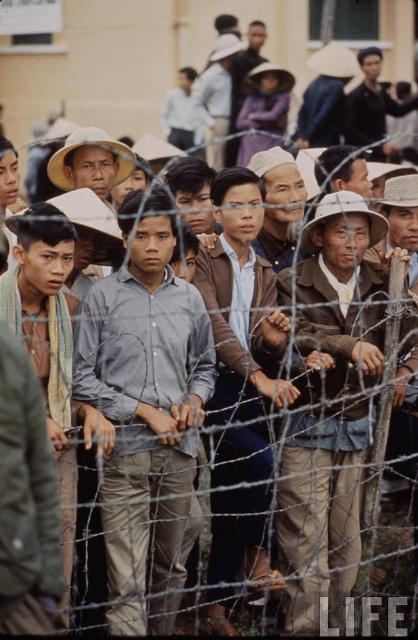
Does light brown fabric shirt at center have a larger size compared to dark green jacket at center?

Correct, light brown fabric shirt at center is larger in size than dark green jacket at center.

Is light brown fabric shirt at center positioned behind dark green jacket at center?

That is True.

This screenshot has height=640, width=418. What are the coordinates of `light brown fabric shirt at center` in the screenshot? It's located at (331, 408).

Can you confirm if light blue shirt at center is shorter than light brown fabric shirt at center?

Yes, light blue shirt at center is shorter than light brown fabric shirt at center.

Between point (145, 552) and point (349, 545), which one is positioned in front?

Point (145, 552)

Image resolution: width=418 pixels, height=640 pixels. Find the location of `light blue shirt at center`. light blue shirt at center is located at coordinates (145, 410).

Can you confirm if light blue shirt at center is smaller than brown leather jacket at center?

Correct, light blue shirt at center occupies less space than brown leather jacket at center.

Find the location of a particular element. The height and width of the screenshot is (640, 418). light blue shirt at center is located at coordinates (145, 410).

At what (x,y) coordinates should I click in order to perform the action: click on light blue shirt at center. Please return your answer as a coordinate pair (x, y). The image size is (418, 640). Looking at the image, I should click on (145, 410).